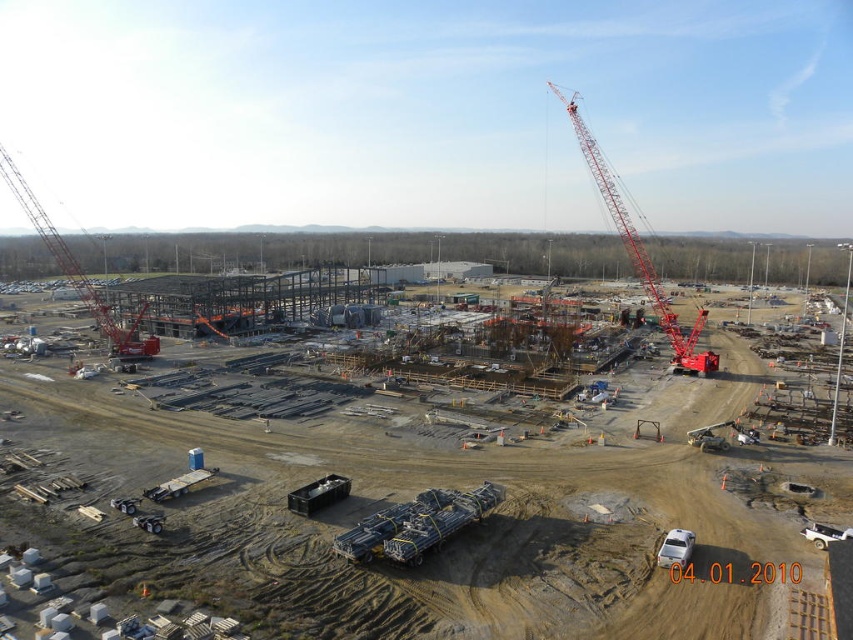
Question: Does metallic gray steel beams at center have a larger size compared to black plastic container at lower center?

Choices:
 (A) no
 (B) yes

Answer: (B)

Question: Which point is farther to the camera?

Choices:
 (A) metal framework at center
 (B) white plastic website at lower center
 (C) white plastic car at lower right
 (D) red metallic crane at upper right

Answer: (D)

Question: Does red metallic crane at upper right have a lesser width compared to white plastic website at lower center?

Choices:
 (A) no
 (B) yes

Answer: (A)

Question: Based on their relative distances, which object is nearer to the metal framework at center?

Choices:
 (A) black plastic container at lower center
 (B) metallic gray steel beams at center

Answer: (B)

Question: Does red metal crane at upper left have a smaller size compared to white plastic car at lower right?

Choices:
 (A) no
 (B) yes

Answer: (A)

Question: Which object is positioned farthest from the metallic gray steel beams at center?

Choices:
 (A) white plastic website at lower center
 (B) red metallic crane at upper right
 (C) black plastic container at lower center
 (D) white plastic car at lower right

Answer: (B)